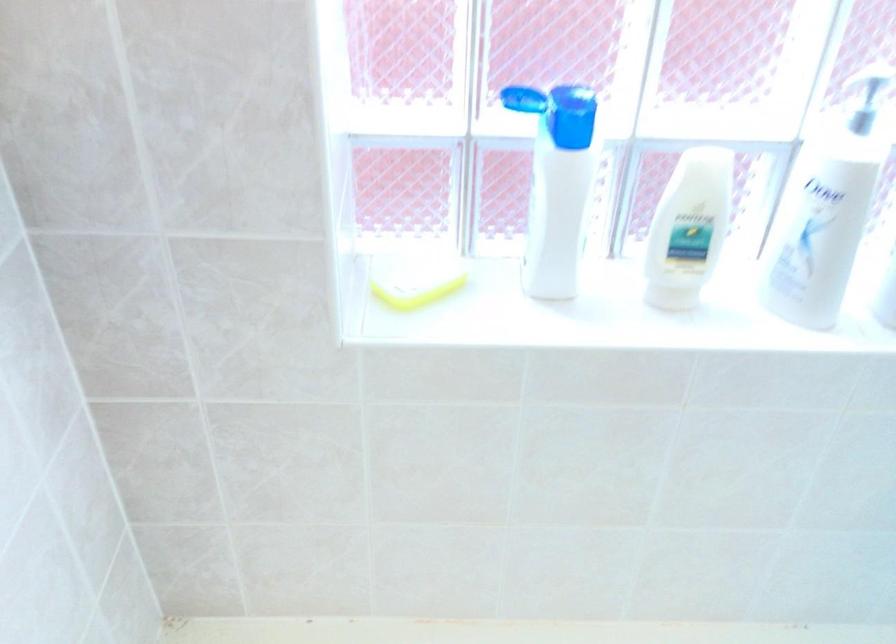
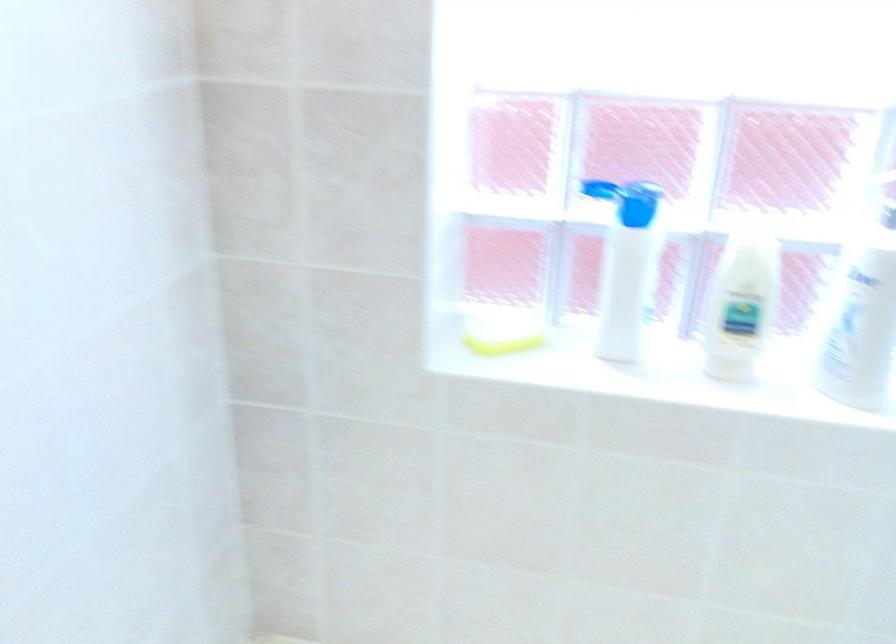
The point at (x=420, y=297) is marked in the first image. Where is the corresponding point in the second image?

(503, 344)